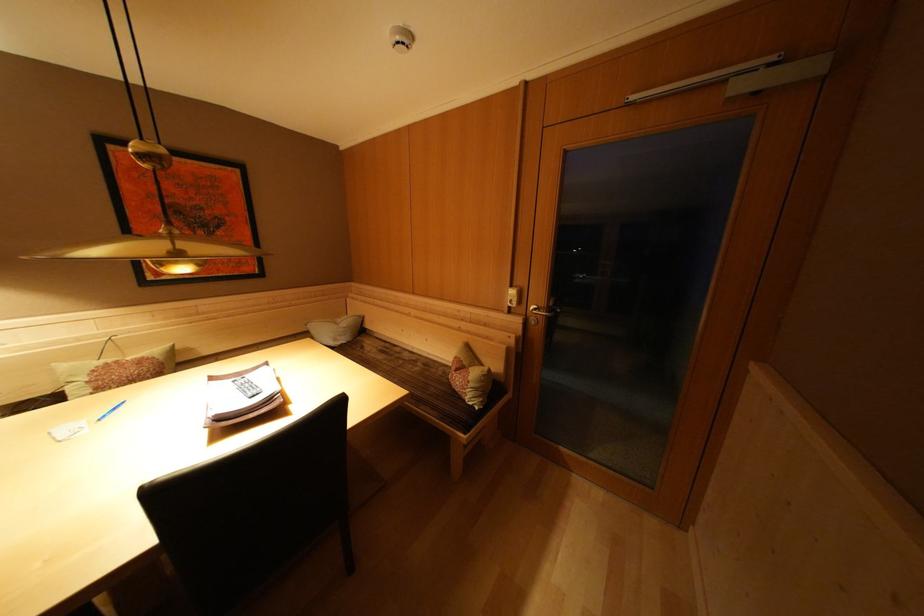
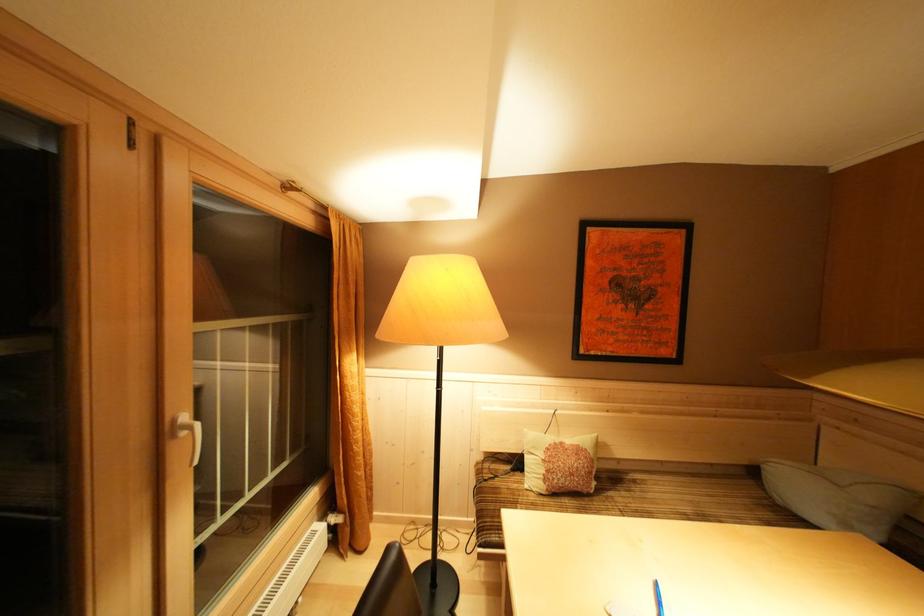
Find the pixel in the second image that matches (x=124, y=367) in the first image.

(568, 448)